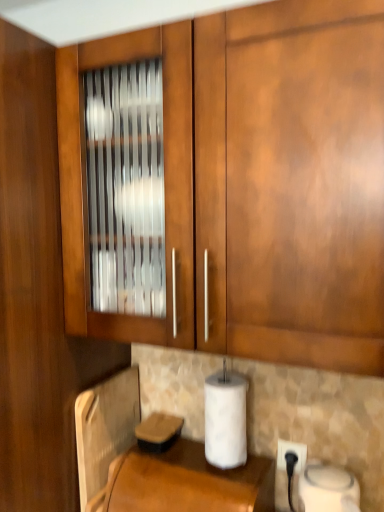
Question: Considering the relative positions of white plastic electric outlet at lower right and white matte paper towel at lower center in the image provided, is white plastic electric outlet at lower right in front of white matte paper towel at lower center?

Choices:
 (A) no
 (B) yes

Answer: (A)

Question: From the image's perspective, would you say white plastic electric outlet at lower right is positioned over white matte paper towel at lower center?

Choices:
 (A) no
 (B) yes

Answer: (A)

Question: Considering the relative sizes of white plastic electric outlet at lower right and white matte paper towel at lower center in the image provided, is white plastic electric outlet at lower right smaller than white matte paper towel at lower center?

Choices:
 (A) no
 (B) yes

Answer: (B)

Question: Is white plastic electric outlet at lower right located outside white matte paper towel at lower center?

Choices:
 (A) yes
 (B) no

Answer: (A)

Question: Is white plastic electric outlet at lower right looking in the opposite direction of white matte paper towel at lower center?

Choices:
 (A) no
 (B) yes

Answer: (A)

Question: Is white plastic electric outlet at lower right thinner than white matte paper towel at lower center?

Choices:
 (A) yes
 (B) no

Answer: (A)

Question: Does metallic silver toaster at lower left have a smaller size compared to brown leather at lower center?

Choices:
 (A) no
 (B) yes

Answer: (B)

Question: From a real-world perspective, does metallic silver toaster at lower left sit lower than brown leather at lower center?

Choices:
 (A) no
 (B) yes

Answer: (A)

Question: Can you confirm if metallic silver toaster at lower left is positioned to the right of brown leather at lower center?

Choices:
 (A) yes
 (B) no

Answer: (B)

Question: Can you confirm if metallic silver toaster at lower left is wider than brown leather at lower center?

Choices:
 (A) no
 (B) yes

Answer: (A)

Question: Considering the relative positions of metallic silver toaster at lower left and brown leather at lower center in the image provided, is metallic silver toaster at lower left to the left of brown leather at lower center from the viewer's perspective?

Choices:
 (A) yes
 (B) no

Answer: (A)

Question: Is the position of metallic silver toaster at lower left less distant than that of brown leather at lower center?

Choices:
 (A) yes
 (B) no

Answer: (B)

Question: From a real-world perspective, is white matte paper towel at lower center below metallic silver toaster at lower left?

Choices:
 (A) no
 (B) yes

Answer: (A)